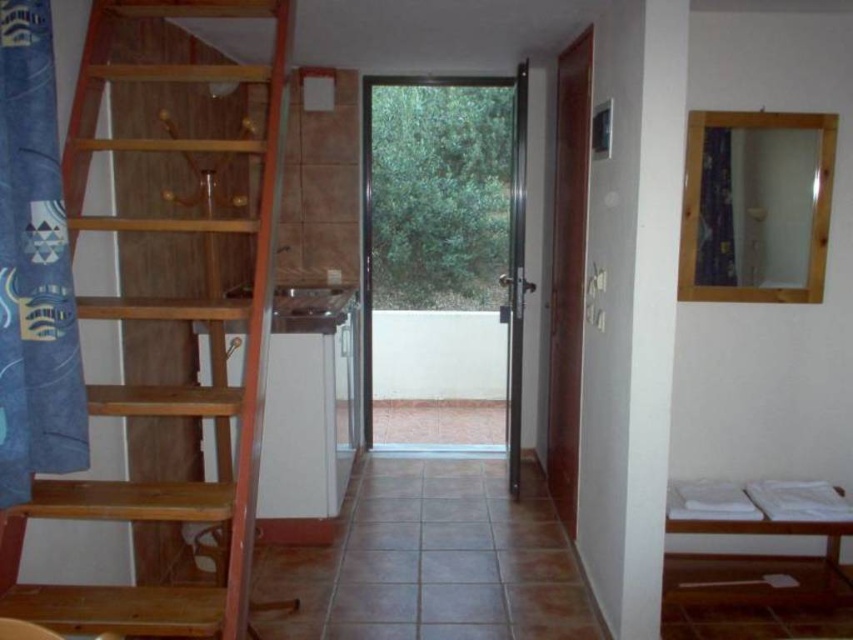
You are standing in the hallway and need to reach the point marked at coordinates (165, 572). The hallway is 3 meters wide. Can you walk straight ahead to reach that point without crossing the hallway?

The point marked at coordinates (165, 572) is 3.11 meters away from the viewer. Since the hallway is 3 meters wide, walking straight ahead would not be sufficient to reach the point as it is slightly beyond the hallway width. You may need to adjust your path or move further forward.

You are a delivery person carrying a large package and need to navigate through the hallway. There is a wooden ladder at left. Can you pass through the hallway without touching the ladder?

The wooden ladder at left is located at point (x=169, y=314). Since the ladder is positioned on the left side of the hallway, you should be able to pass through the hallway by staying on the right side, avoiding contact with the ladder.

You are a delivery person trying to navigate through the hallway. You need to deliver a package to the room near the white wooden bunk bed at lower right. Is the wooden ladder at left in your way?

The wooden ladder at left is closer to the viewer than the white wooden bunk bed at lower right, so it is blocking the path to the bunk bed and would be in your way.